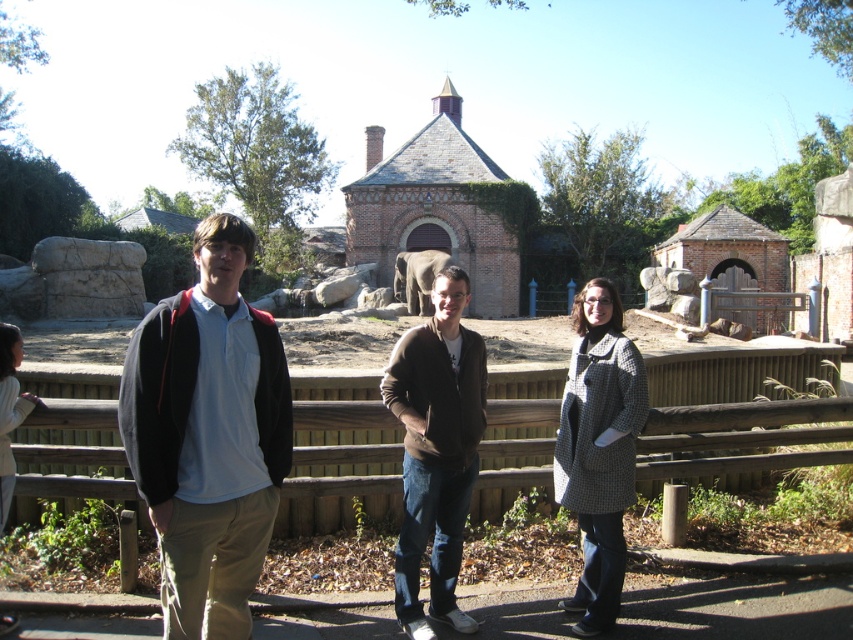
You are a photographer trying to capture a group photo of the people on the paved pathway. The two central figures are wearing a brown sweater at center and a houndstooth coat at center. Which of these two items of clothing is bigger in size?

The brown sweater at center has a larger size compared to the houndstooth coat at center.

Please describe the position of the wooden at center in terms of coordinates. The scene is a zoo area with three people on a paved path separated by a wooden fence. The background has a brick building with a pointed roof and a small tower.

The wooden at center is located at coordinates point (x=735, y=413).